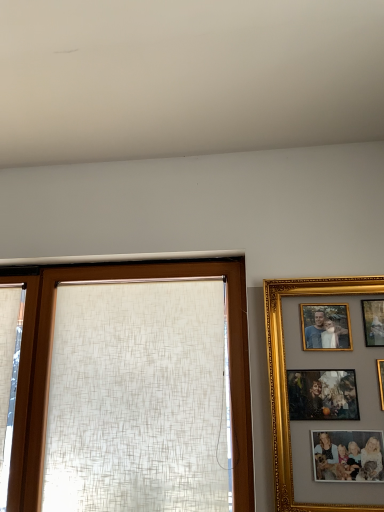
Question: Does white textured curtain at left have a larger size compared to matte beige curtain at center?

Choices:
 (A) yes
 (B) no

Answer: (B)

Question: Is white textured curtain at left oriented towards matte beige curtain at center?

Choices:
 (A) no
 (B) yes

Answer: (A)

Question: Would you say white textured curtain at left is outside matte beige curtain at center?

Choices:
 (A) no
 (B) yes

Answer: (B)

Question: From the image's perspective, is white textured curtain at left beneath matte beige curtain at center?

Choices:
 (A) yes
 (B) no

Answer: (A)

Question: From a real-world perspective, is white textured curtain at left positioned over matte beige curtain at center based on gravity?

Choices:
 (A) no
 (B) yes

Answer: (A)

Question: Is white textured curtain at left wider or thinner than matte beige curtain at center?

Choices:
 (A) thin
 (B) wide

Answer: (A)

Question: In the image, is white textured curtain at left on the left side or the right side of matte beige curtain at center?

Choices:
 (A) right
 (B) left

Answer: (B)

Question: From a real-world perspective, is white textured curtain at left above or below matte beige curtain at center?

Choices:
 (A) above
 (B) below

Answer: (B)

Question: From the image's perspective, relative to matte beige curtain at center, is white textured curtain at left above or below?

Choices:
 (A) below
 (B) above

Answer: (A)

Question: Does point (354, 504) appear closer or farther from the camera than point (8, 362)?

Choices:
 (A) closer
 (B) farther

Answer: (A)

Question: Is gold/gilded picture frame at right inside the boundaries of white textured curtain at left, or outside?

Choices:
 (A) outside
 (B) inside

Answer: (A)

Question: In the image, is gold/gilded picture frame at right on the left side or the right side of white textured curtain at left?

Choices:
 (A) left
 (B) right

Answer: (B)

Question: From a real-world perspective, is gold/gilded picture frame at right physically located above or below white textured curtain at left?

Choices:
 (A) above
 (B) below

Answer: (B)

Question: Is gold/gilded picture frame at right bigger or smaller than matte beige curtain at center?

Choices:
 (A) small
 (B) big

Answer: (A)

Question: Considering the relative positions of gold/gilded picture frame at right and matte beige curtain at center in the image provided, is gold/gilded picture frame at right to the left or to the right of matte beige curtain at center?

Choices:
 (A) left
 (B) right

Answer: (B)